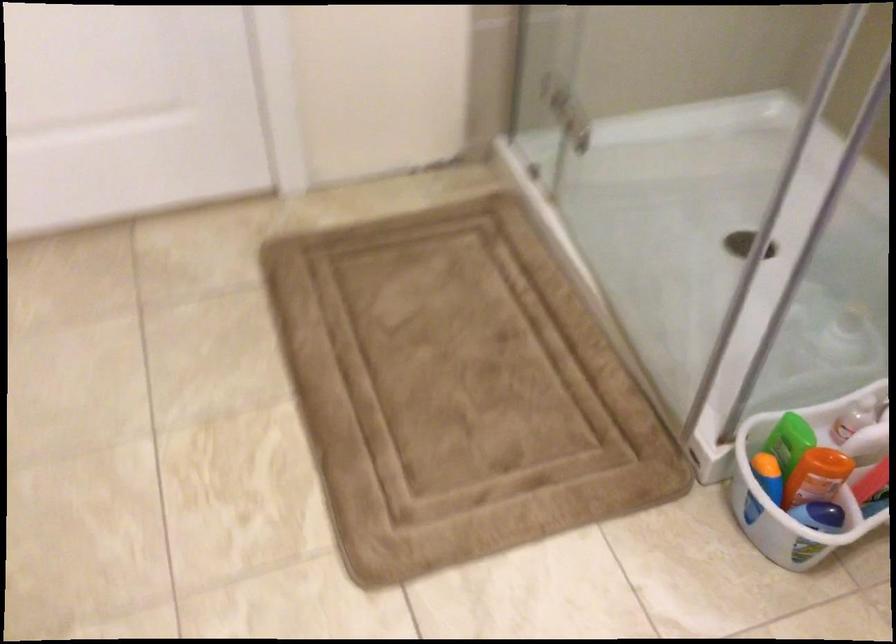
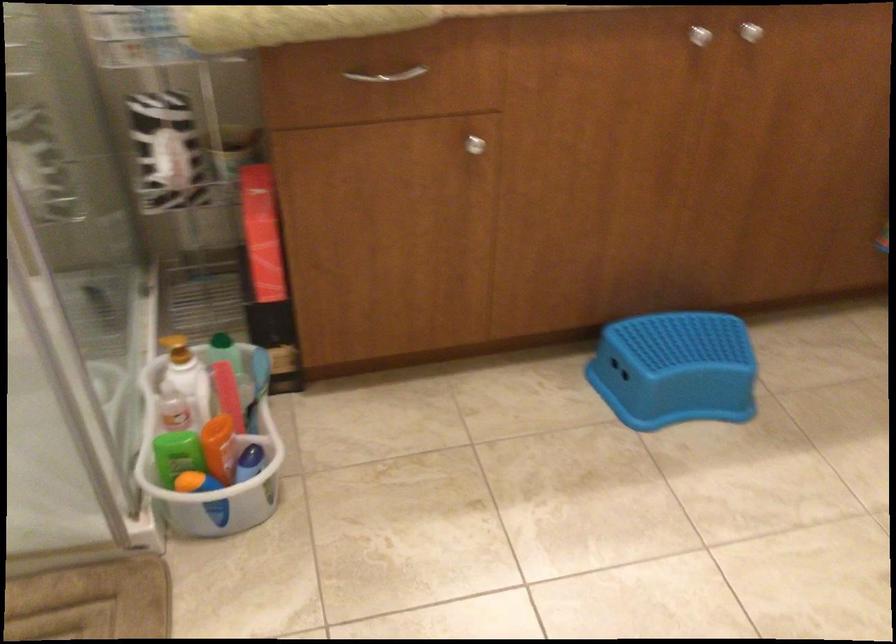
Where in the second image is the point corresponding to (821,459) from the first image?

(208, 439)